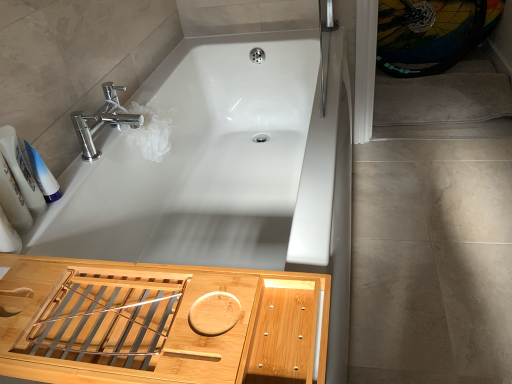
Question: Considering the positions of point (61, 195) and point (4, 130), is point (61, 195) closer or farther from the camera than point (4, 130)?

Choices:
 (A) closer
 (B) farther

Answer: (B)

Question: From the image's perspective, is white plastic tube at left, the second toiletry from the left, located above or below white glossy bottles at left, the second toiletry from the right?

Choices:
 (A) below
 (B) above

Answer: (B)

Question: Based on their relative distances, which object is nearer to the white glossy bathtub at center?

Choices:
 (A) chrome/metallic faucet at upper left
 (B) bamboo tray at lower left
 (C) white plastic tube at left, which is counted as the 1th toiletry, starting from the right
 (D) gray carpet at right
 (E) beige tile floor at lower right

Answer: (A)

Question: Which of these objects is positioned closest to the white glossy bottles at left, the 1th toiletry positioned from the left?

Choices:
 (A) white glossy bathtub at center
 (B) gray carpet at right
 (C) multicolored rubber bicycle wheel at upper right
 (D) chrome/metallic faucet at upper left
 (E) beige tile floor at lower right

Answer: (D)